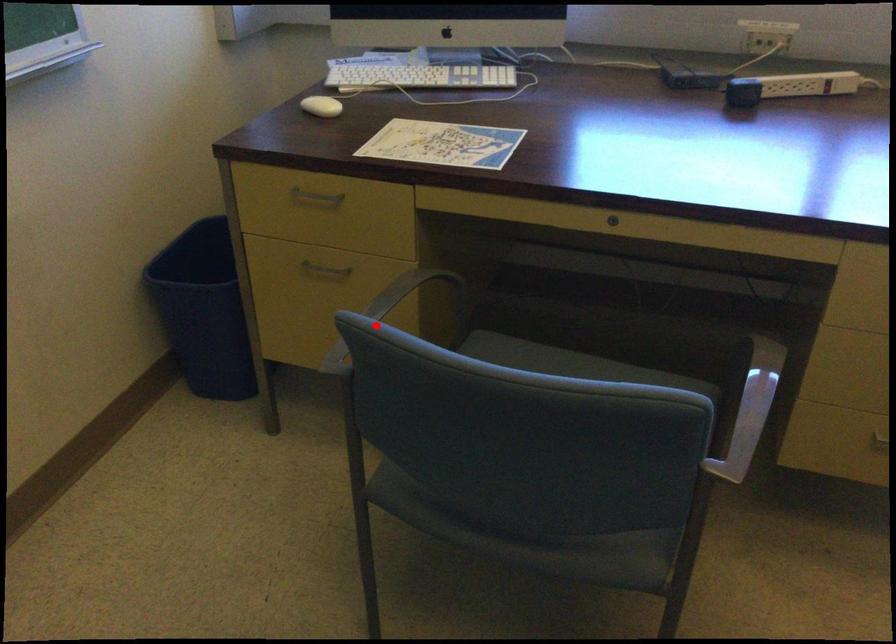
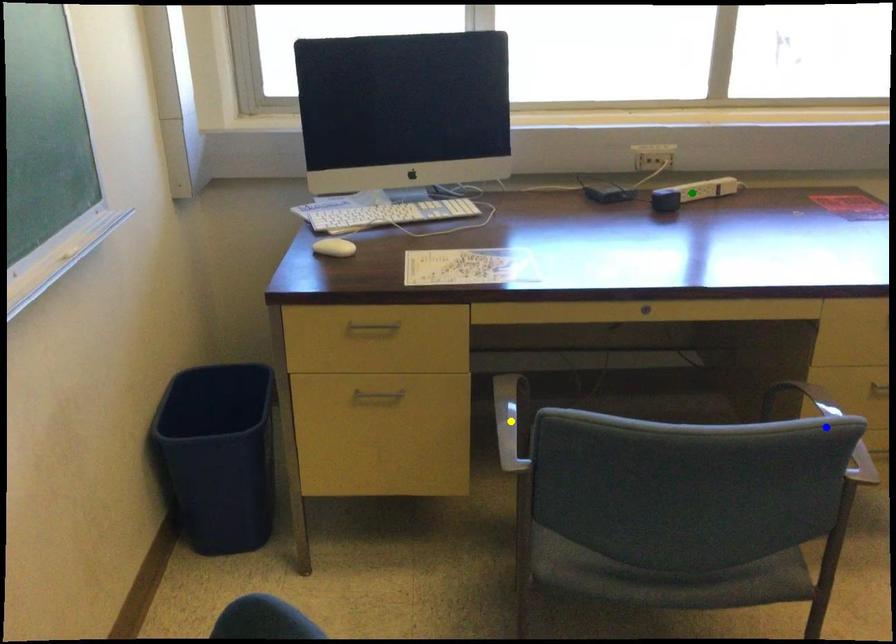
Question: I am providing you with two images of the same scene from different viewpoints. A red point is marked on the first image. You are given multiple points on the second image. Can you choose the point in image 2 that corresponds to the point in image 1?

Choices:
 (A) green point
 (B) yellow point
 (C) blue point

Answer: (B)